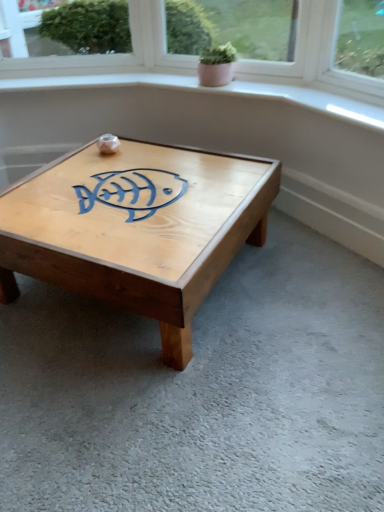
The height and width of the screenshot is (512, 384). Find the location of `free region on the left part of pink matte pot at upper center`. free region on the left part of pink matte pot at upper center is located at coordinates (176, 80).